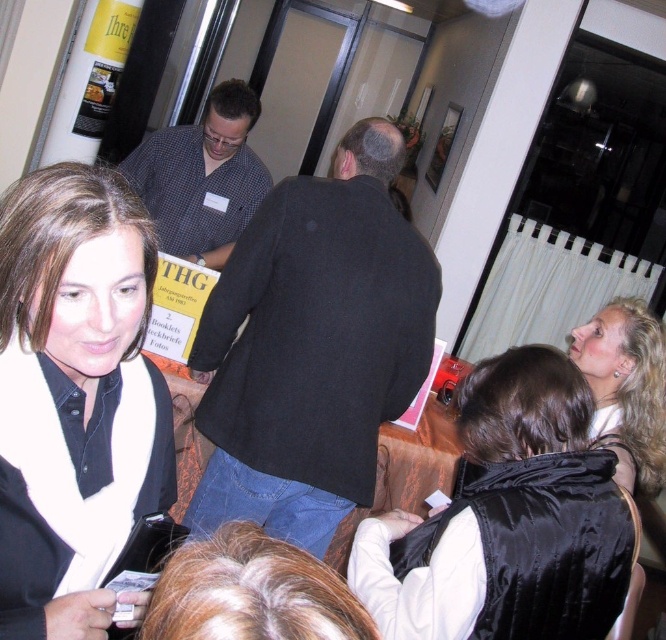
Based on the photo, who is lower down, black wool coat at center or checkered fabric shirt at center?

Positioned lower is black wool coat at center.

Between black wool coat at center and checkered fabric shirt at center, which one appears on the left side from the viewer's perspective?

checkered fabric shirt at center is more to the left.

From the picture: Measure the distance between point (246, 401) and camera.

Point (246, 401) is 5.90 feet from camera.

In order to click on black wool coat at center in this screenshot , I will do `click(312, 346)`.

Which is more to the left, black wool coat at center or blonde hair at upper right?

Positioned to the left is black wool coat at center.

Identify the location of black wool coat at center. (312, 346).

Locate an element on the screen. The width and height of the screenshot is (666, 640). black wool coat at center is located at coordinates (312, 346).

In the scene shown: Does black wool coat at center have a lesser height compared to black satin vest at lower right?

In fact, black wool coat at center may be taller than black satin vest at lower right.

Who is more distant from viewer, (x=396, y=173) or (x=472, y=445)?

Positioned behind is point (x=396, y=173).

Is point (344, 140) in front of point (541, 385)?

No.

You are a GUI agent. You are given a task and a screenshot of the screen. Output one action in this format:
    pyautogui.click(x=<x>, y=<y>)
    Task: Click on the black wool coat at center
    
    Given the screenshot: What is the action you would take?
    pyautogui.click(x=312, y=346)